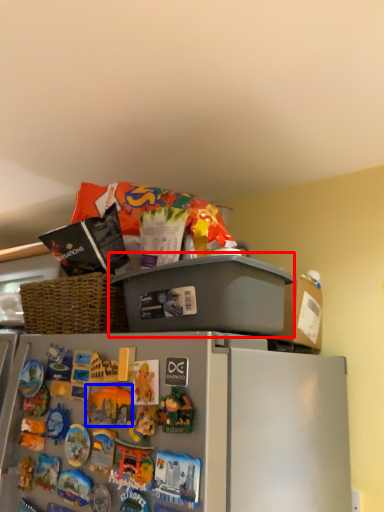
Question: Which of the following is the closest to the observer, appliance (highlighted by a red box) or toy (highlighted by a blue box)?

Choices:
 (A) appliance
 (B) toy

Answer: (B)